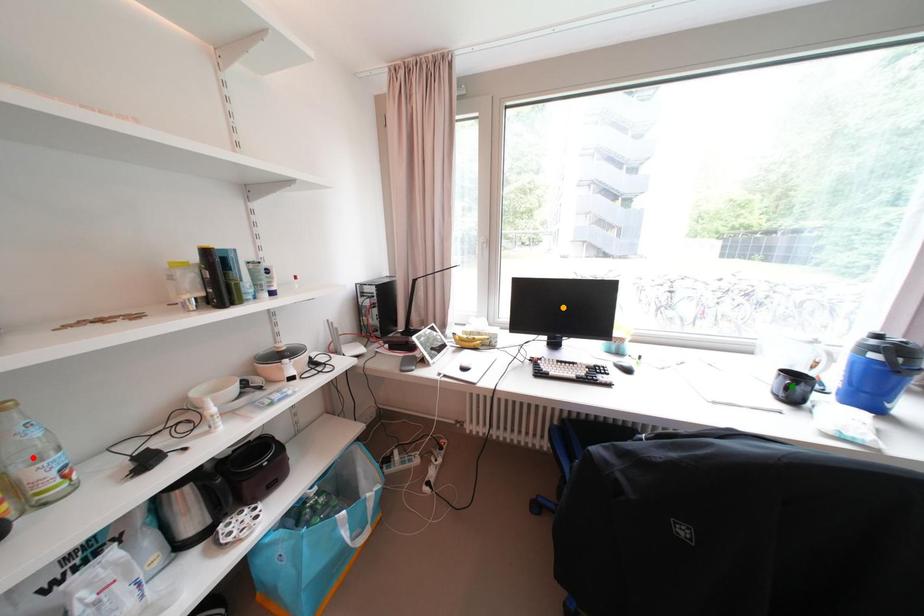
Order these from nearest to farthest:
A) red point
B) orange point
C) green point

1. red point
2. green point
3. orange point